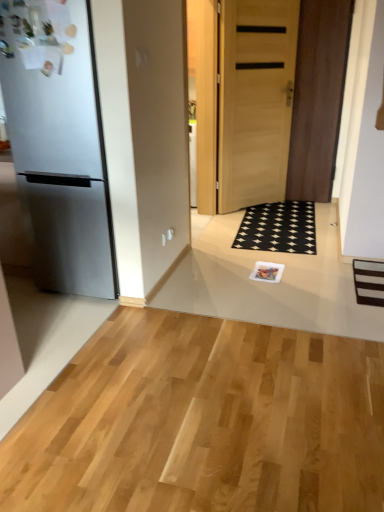
Question: Could light brown wood door at center, positioned as the 2th door in left-to-right order, be considered to be inside matte plastic magazine at center?

Choices:
 (A) yes
 (B) no

Answer: (B)

Question: Would you say matte plastic magazine at center is a long distance from light brown wood door at center, the 1th door positioned from the right?

Choices:
 (A) yes
 (B) no

Answer: (A)

Question: Does matte plastic magazine at center have a larger size compared to light brown wood door at center, positioned as the 2th door in left-to-right order?

Choices:
 (A) no
 (B) yes

Answer: (A)

Question: From the image's perspective, is matte plastic magazine at center on light brown wood door at center, the 1th door positioned from the right?

Choices:
 (A) no
 (B) yes

Answer: (A)

Question: Does matte plastic magazine at center come behind light brown wood door at center, positioned as the 2th door in left-to-right order?

Choices:
 (A) yes
 (B) no

Answer: (B)

Question: Is light brown wood door at center, the 1th door positioned from the right, to the left or to the right of matte plastic magazine at center in the image?

Choices:
 (A) right
 (B) left

Answer: (A)

Question: Which is correct: light brown wood door at center, positioned as the 2th door in left-to-right order, is inside matte plastic magazine at center, or outside of it?

Choices:
 (A) outside
 (B) inside

Answer: (A)

Question: Considering the positions of light brown wood door at center, positioned as the 2th door in left-to-right order, and matte plastic magazine at center in the image, is light brown wood door at center, positioned as the 2th door in left-to-right order, taller or shorter than matte plastic magazine at center?

Choices:
 (A) short
 (B) tall

Answer: (B)

Question: Relative to matte plastic magazine at center, is light brown wood door at center, positioned as the 2th door in left-to-right order, in front or behind?

Choices:
 (A) behind
 (B) front

Answer: (A)

Question: In terms of size, does satin black refrigerator at left appear bigger or smaller than light brown wood door at center, acting as the second door starting from the right?

Choices:
 (A) small
 (B) big

Answer: (B)

Question: Looking at their shapes, would you say satin black refrigerator at left is wider or thinner than light brown wood door at center, which is the first door in left-to-right order?

Choices:
 (A) thin
 (B) wide

Answer: (B)

Question: From the image's perspective, relative to light brown wood door at center, which is the first door in left-to-right order, is satin black refrigerator at left above or below?

Choices:
 (A) below
 (B) above

Answer: (A)

Question: From a real-world perspective, is satin black refrigerator at left above or below light brown wood door at center, acting as the second door starting from the right?

Choices:
 (A) below
 (B) above

Answer: (A)

Question: Does point (51, 259) appear closer or farther from the camera than point (309, 240)?

Choices:
 (A) closer
 (B) farther

Answer: (A)

Question: Considering their positions, is satin black refrigerator at left located in front of or behind black rubber doormat at center?

Choices:
 (A) behind
 (B) front

Answer: (B)